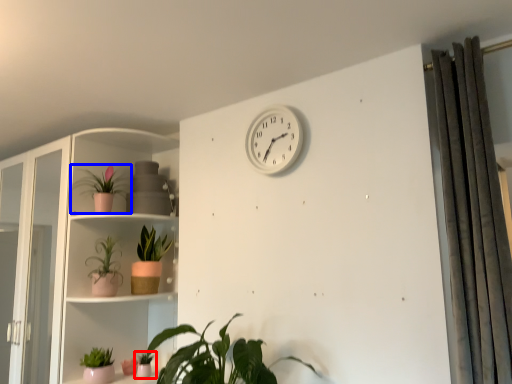
Question: Among these objects, which one is nearest to the camera, houseplant (highlighted by a red box) or houseplant (highlighted by a blue box)?

Choices:
 (A) houseplant
 (B) houseplant

Answer: (B)